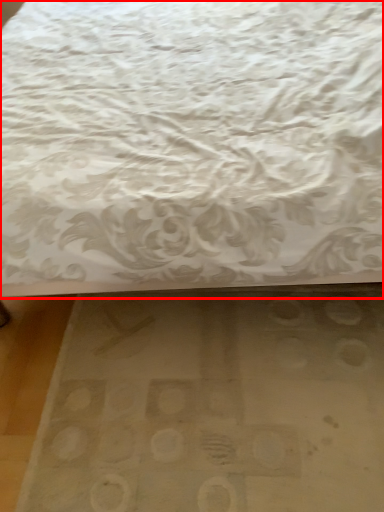
Question: From the image's perspective, what is the correct spatial relationship of bed (annotated by the red box) in relation to mat?

Choices:
 (A) above
 (B) below

Answer: (A)